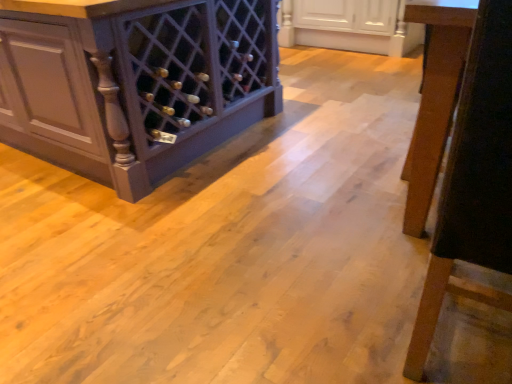
Describe the element at coordinates (473, 181) in the screenshot. Image resolution: width=512 pixels, height=384 pixels. I see `wooden chair leg at right` at that location.

Identify the location of wooden chair leg at right. The image size is (512, 384). (x=473, y=181).

Considering the relative sizes of wooden chair leg at right and white glossy cabinet at upper center, which appears as the 2th cabinetry when viewed from the left, in the image provided, is wooden chair leg at right wider than white glossy cabinet at upper center, which appears as the 2th cabinetry when viewed from the left,?

No.

From a real-world perspective, is wooden chair leg at right located beneath white glossy cabinet at upper center, which appears as the 2th cabinetry when viewed from the left?

No, from a real-world perspective, wooden chair leg at right is not below white glossy cabinet at upper center, which appears as the 2th cabinetry when viewed from the left.

You are a GUI agent. You are given a task and a screenshot of the screen. Output one action in this format:
    pyautogui.click(x=<x>, y=<y>)
    Task: Click on the furniture located on the left of white glossy cabinet at upper center, which appears as the 2th cabinetry when viewed from the left
    
    Given the screenshot: What is the action you would take?
    pyautogui.click(x=473, y=181)

Is wooden chair leg at right directly adjacent to white glossy cabinet at upper center, which appears as the 2th cabinetry when viewed from the left?

No.

Is matte dark wood wine rack at left, which ranks as the 2th cabinetry in right-to-left order, positioned with its back to wooden chair leg at right?

That's right, matte dark wood wine rack at left, which ranks as the 2th cabinetry in right-to-left order, is facing away from wooden chair leg at right.

From a real-world perspective, is matte dark wood wine rack at left, which ranks as the 2th cabinetry in right-to-left order, physically above wooden chair leg at right?

No, from a real-world perspective, matte dark wood wine rack at left, which ranks as the 2th cabinetry in right-to-left order, is not above wooden chair leg at right.

Is white glossy cabinet at upper center, which is counted as the 1th cabinetry, starting from the right, inside or outside of matte dark wood wine rack at left, the 1th cabinetry from the left?

white glossy cabinet at upper center, which is counted as the 1th cabinetry, starting from the right, is located beyond the bounds of matte dark wood wine rack at left, the 1th cabinetry from the left.

Does white glossy cabinet at upper center, which appears as the 2th cabinetry when viewed from the left, appear on the right side of matte dark wood wine rack at left, which ranks as the 2th cabinetry in right-to-left order?

Yes.

Is white glossy cabinet at upper center, which is counted as the 1th cabinetry, starting from the right, positioned with its back to matte dark wood wine rack at left, which ranks as the 2th cabinetry in right-to-left order?

No, matte dark wood wine rack at left, which ranks as the 2th cabinetry in right-to-left order, is not at the back of white glossy cabinet at upper center, which is counted as the 1th cabinetry, starting from the right.

From the image's perspective, is white glossy cabinet at upper center, which is counted as the 1th cabinetry, starting from the right, located above matte dark wood wine rack at left, the 1th cabinetry from the left?

Yes, from the image's perspective, white glossy cabinet at upper center, which is counted as the 1th cabinetry, starting from the right, is over matte dark wood wine rack at left, the 1th cabinetry from the left.

Which is farther from the camera, (391,23) or (507,190)?

Positioned behind is point (391,23).

From a real-world perspective, who is located lower, white glossy cabinet at upper center, which is counted as the 1th cabinetry, starting from the right, or wooden chair leg at right?

white glossy cabinet at upper center, which is counted as the 1th cabinetry, starting from the right, from a real-world perspective.

Is white glossy cabinet at upper center, which is counted as the 1th cabinetry, starting from the right, behind wooden chair leg at right?

Yes, white glossy cabinet at upper center, which is counted as the 1th cabinetry, starting from the right, is behind wooden chair leg at right.

Is white glossy cabinet at upper center, which is counted as the 1th cabinetry, starting from the right, facing towards wooden chair leg at right?

Yes, white glossy cabinet at upper center, which is counted as the 1th cabinetry, starting from the right, is aimed at wooden chair leg at right.

At what (x,y) coordinates should I click in order to perform the action: click on furniture in front of the matte dark wood wine rack at left, the 1th cabinetry from the left. Please return your answer as a coordinate pair (x, y). The width and height of the screenshot is (512, 384). Looking at the image, I should click on (473, 181).

From a real-world perspective, which object stands above the other?

wooden chair leg at right, from a real-world perspective.

Is wooden chair leg at right situated inside matte dark wood wine rack at left, the 1th cabinetry from the left, or outside?

wooden chair leg at right is outside matte dark wood wine rack at left, the 1th cabinetry from the left.

Is point (476, 145) closer to camera compared to point (36, 0)?

Yes, point (476, 145) is in front of point (36, 0).

How many degrees apart are the facing directions of matte dark wood wine rack at left, the 1th cabinetry from the left, and white glossy cabinet at upper center, which appears as the 2th cabinetry when viewed from the left?

matte dark wood wine rack at left, the 1th cabinetry from the left, and white glossy cabinet at upper center, which appears as the 2th cabinetry when viewed from the left, are facing 89.2 degrees away from each other.

Is matte dark wood wine rack at left, the 1th cabinetry from the left, aimed at white glossy cabinet at upper center, which appears as the 2th cabinetry when viewed from the left?

No, matte dark wood wine rack at left, the 1th cabinetry from the left, is not facing towards white glossy cabinet at upper center, which appears as the 2th cabinetry when viewed from the left.

Between matte dark wood wine rack at left, which ranks as the 2th cabinetry in right-to-left order, and white glossy cabinet at upper center, which is counted as the 1th cabinetry, starting from the right, which one has smaller size?

white glossy cabinet at upper center, which is counted as the 1th cabinetry, starting from the right.

Which of these two, matte dark wood wine rack at left, which ranks as the 2th cabinetry in right-to-left order, or white glossy cabinet at upper center, which is counted as the 1th cabinetry, starting from the right, is thinner?

Thinner between the two is white glossy cabinet at upper center, which is counted as the 1th cabinetry, starting from the right.

Where is `furniture on the left of white glossy cabinet at upper center, which appears as the 2th cabinetry when viewed from the left`? furniture on the left of white glossy cabinet at upper center, which appears as the 2th cabinetry when viewed from the left is located at coordinates (473, 181).

At what (x,y) coordinates should I click in order to perform the action: click on furniture located above the matte dark wood wine rack at left, the 1th cabinetry from the left (from a real-world perspective). Please return your answer as a coordinate pair (x, y). Image resolution: width=512 pixels, height=384 pixels. Looking at the image, I should click on (473, 181).

Based on their spatial positions, is matte dark wood wine rack at left, the 1th cabinetry from the left, or white glossy cabinet at upper center, which appears as the 2th cabinetry when viewed from the left, further from wooden chair leg at right?

The object further to wooden chair leg at right is white glossy cabinet at upper center, which appears as the 2th cabinetry when viewed from the left.

Which object lies nearer to the anchor point matte dark wood wine rack at left, the 1th cabinetry from the left, white glossy cabinet at upper center, which appears as the 2th cabinetry when viewed from the left, or wooden chair leg at right?

Among the two, wooden chair leg at right is located nearer to matte dark wood wine rack at left, the 1th cabinetry from the left.

Looking at the image, which one is located closer to wooden chair leg at right, white glossy cabinet at upper center, which appears as the 2th cabinetry when viewed from the left, or matte dark wood wine rack at left, which ranks as the 2th cabinetry in right-to-left order?

matte dark wood wine rack at left, which ranks as the 2th cabinetry in right-to-left order.

Based on their spatial positions, is matte dark wood wine rack at left, which ranks as the 2th cabinetry in right-to-left order, or wooden chair leg at right closer to white glossy cabinet at upper center, which appears as the 2th cabinetry when viewed from the left?

Based on the image, matte dark wood wine rack at left, which ranks as the 2th cabinetry in right-to-left order, appears to be nearer to white glossy cabinet at upper center, which appears as the 2th cabinetry when viewed from the left.

Looking at the image, which one is located further to white glossy cabinet at upper center, which is counted as the 1th cabinetry, starting from the right, wooden chair leg at right or matte dark wood wine rack at left, the 1th cabinetry from the left?

wooden chair leg at right is positioned further to the anchor white glossy cabinet at upper center, which is counted as the 1th cabinetry, starting from the right.

Considering their positions, is wooden chair leg at right positioned closer to matte dark wood wine rack at left, which ranks as the 2th cabinetry in right-to-left order, than white glossy cabinet at upper center, which is counted as the 1th cabinetry, starting from the right?

wooden chair leg at right.

You are a GUI agent. You are given a task and a screenshot of the screen. Output one action in this format:
    pyautogui.click(x=<x>, y=<y>)
    Task: Click on the cabinetry between wooden chair leg at right and white glossy cabinet at upper center, which is counted as the 1th cabinetry, starting from the right, in the front-back direction
    The image size is (512, 384).
    Given the screenshot: What is the action you would take?
    pyautogui.click(x=134, y=82)